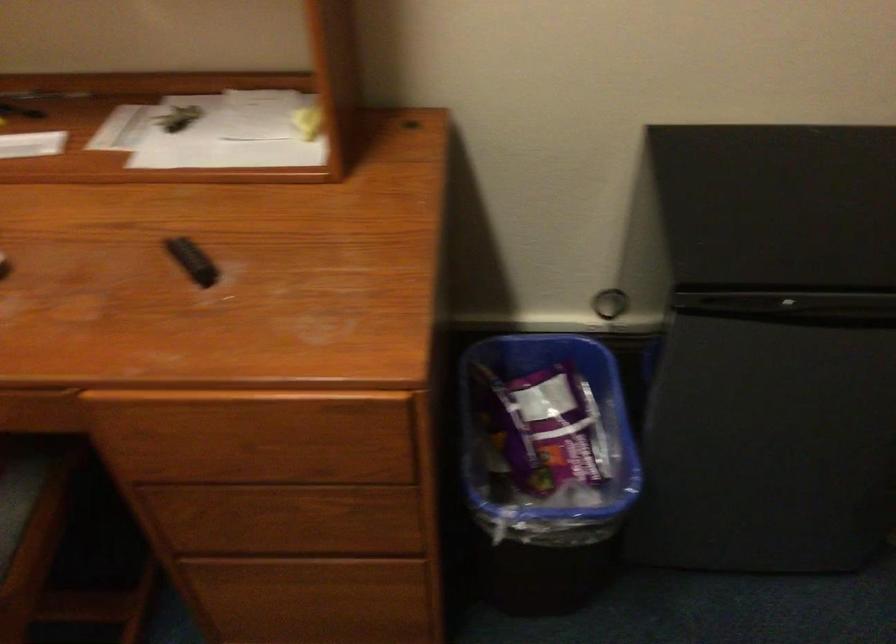
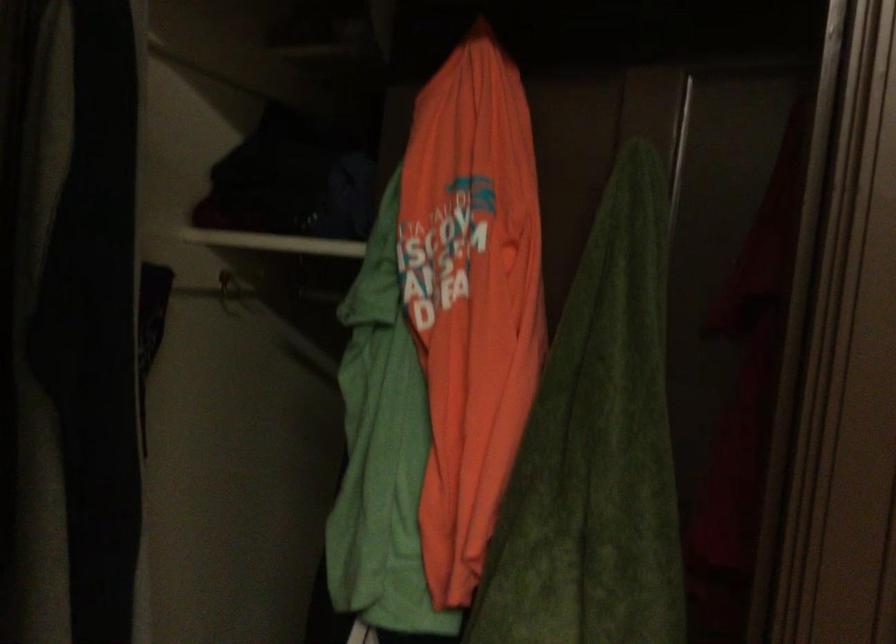
Question: The first image is from the beginning of the video and the second image is from the end. How did the camera likely rotate when shooting the video?

Choices:
 (A) Left
 (B) Right
 (C) Up
 (D) Down

Answer: (B)